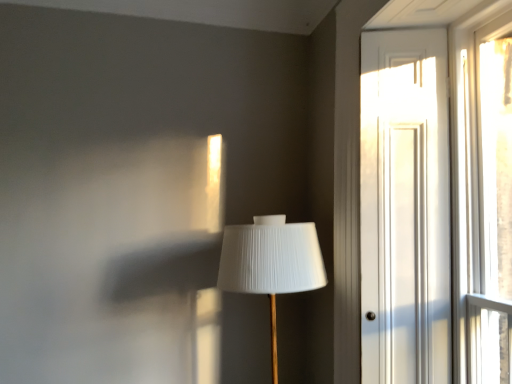
The height and width of the screenshot is (384, 512). What do you see at coordinates (271, 263) in the screenshot? I see `white pleated fabric lampshade at center` at bounding box center [271, 263].

Where is `white pleated fabric lampshade at center`? This screenshot has height=384, width=512. white pleated fabric lampshade at center is located at coordinates (271, 263).

Find the location of a particular element. The height and width of the screenshot is (384, 512). white pleated fabric lampshade at center is located at coordinates (271, 263).